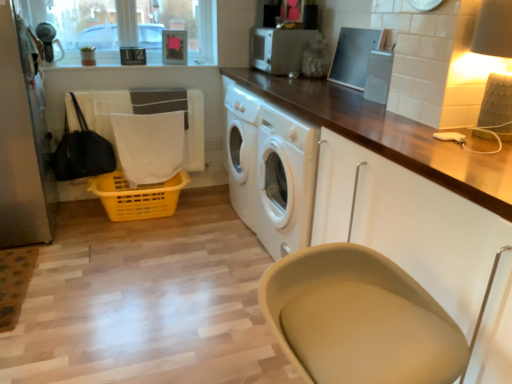
You are a GUI agent. You are given a task and a screenshot of the screen. Output one action in this format:
    pyautogui.click(x=<x>, y=<y>)
    Task: Click on the free spot to the right of satin silver screen door at left
    Image resolution: width=512 pixels, height=384 pixels.
    Given the screenshot: What is the action you would take?
    pyautogui.click(x=104, y=245)